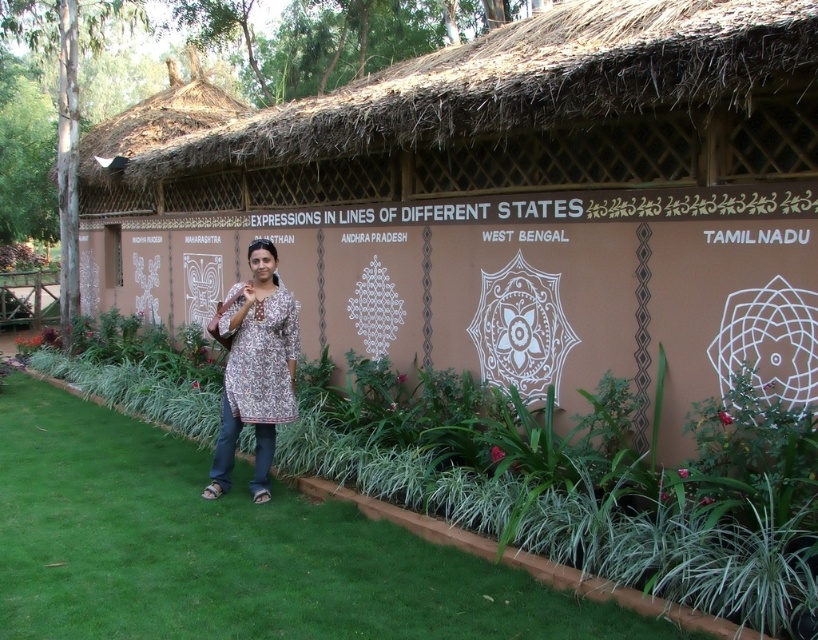
Question: Can you confirm if brown thatched roof hut at center is smaller than green grass at lower center?

Choices:
 (A) yes
 (B) no

Answer: (B)

Question: Which object is closer to the camera taking this photo?

Choices:
 (A) printed cotton kurta at center
 (B) brown thatched roof hut at center

Answer: (B)

Question: Does brown thatched roof hut at center appear on the right side of green grass at lower center?

Choices:
 (A) no
 (B) yes

Answer: (A)

Question: Does brown thatched roof hut at center have a lesser width compared to printed cotton kurta at center?

Choices:
 (A) no
 (B) yes

Answer: (A)

Question: Which object is closer to the camera taking this photo?

Choices:
 (A) brown thatched roof hut at center
 (B) printed cotton kurta at center

Answer: (A)

Question: Which point is closer to the camera taking this photo?

Choices:
 (A) (461, 248)
 (B) (111, 461)

Answer: (A)